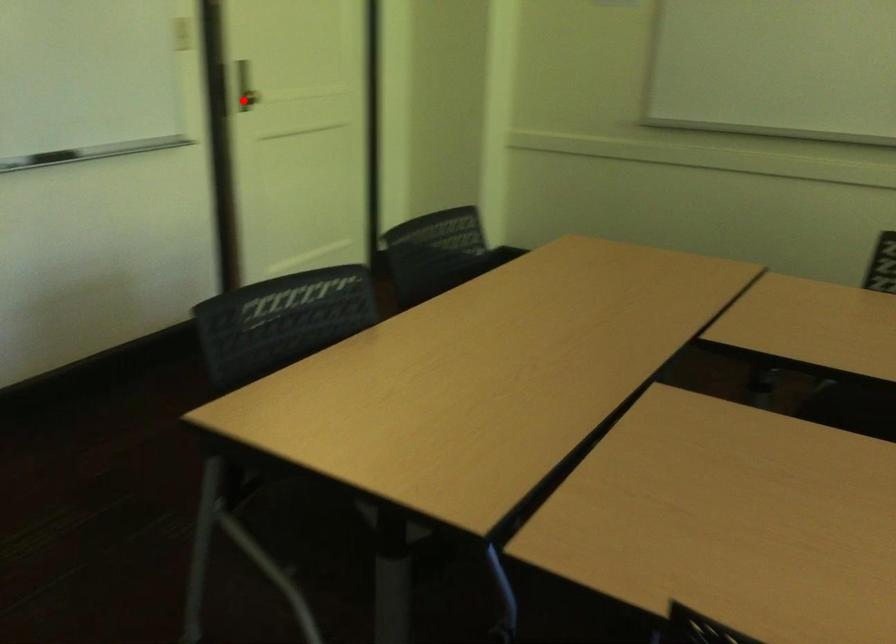
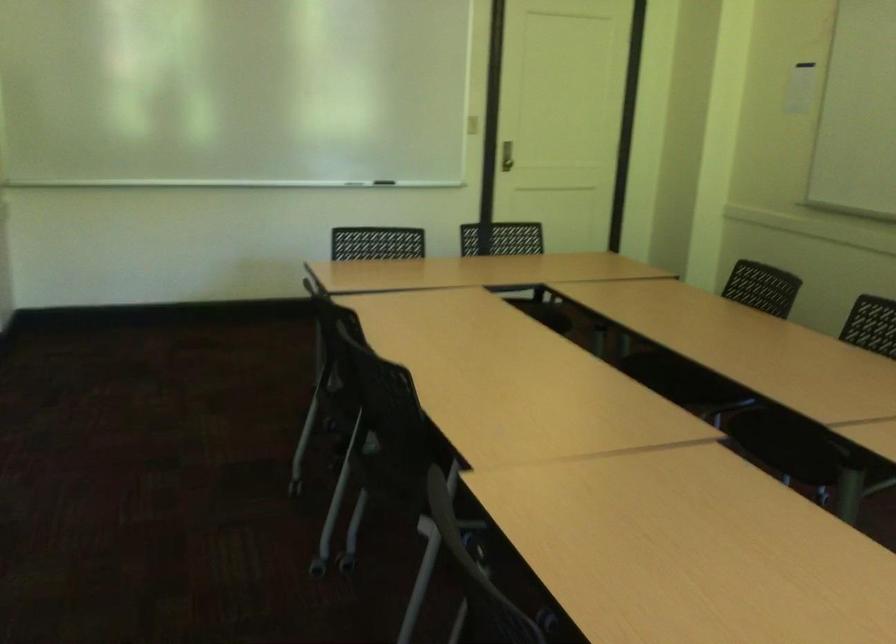
Where in the second image is the point corresponding to the highlighted location from the first image?

(506, 156)